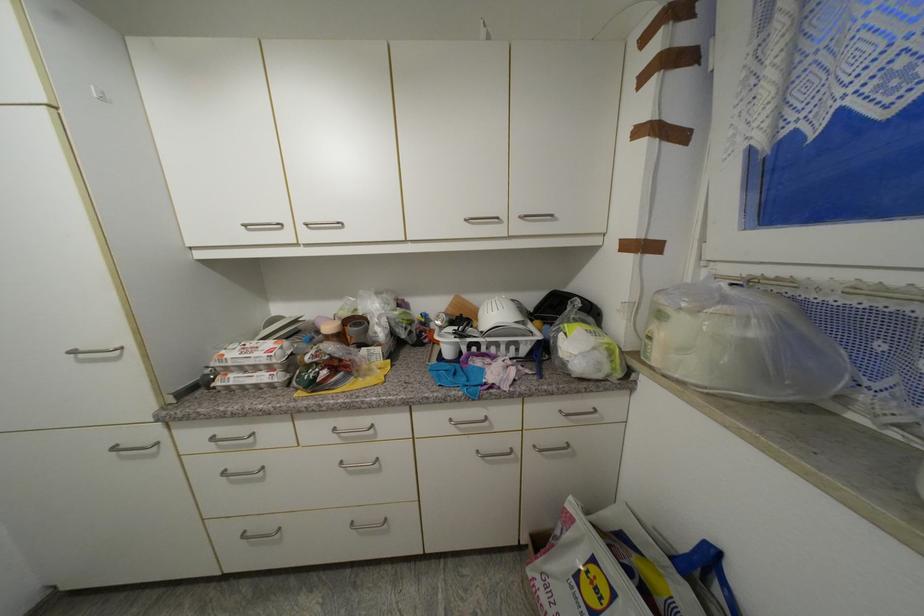
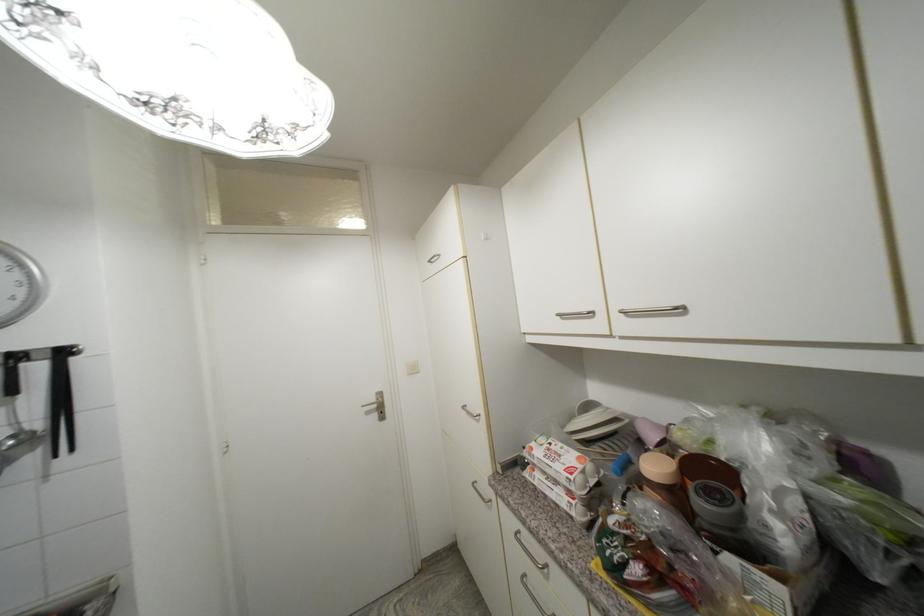
Where in the second image is the point corresponding to the point at 284,225 from the first image?

(594, 314)